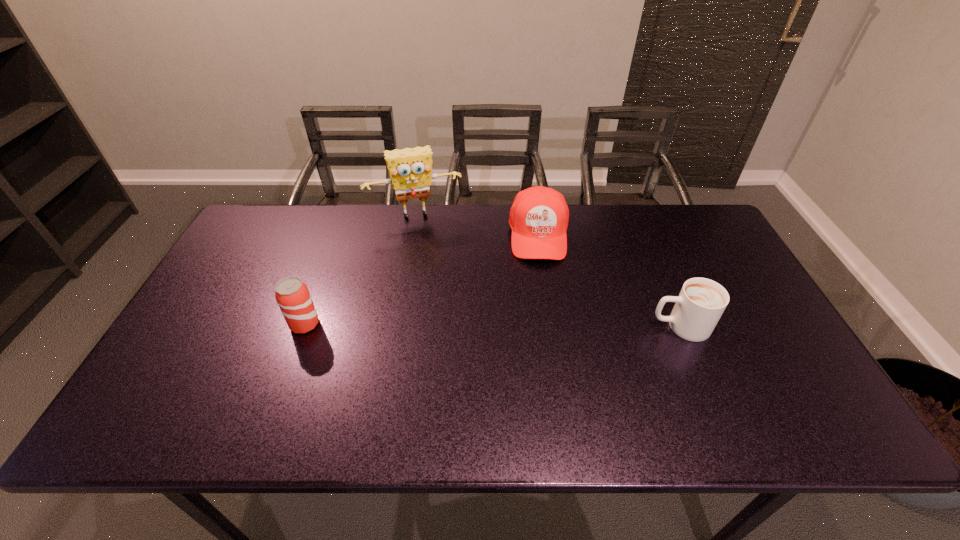
Find the location of `vacant space on the desktop that is between the leftmost object and the cappuccino and is positioned on the face of the tallest object`. vacant space on the desktop that is between the leftmost object and the cappuccino and is positioned on the face of the tallest object is located at coordinates (443, 325).

The height and width of the screenshot is (540, 960). In order to click on free space on the desktop that is between the beer can and the cappuccino and is positioned on the front panel of the baseball cap in this screenshot , I will do `click(543, 326)`.